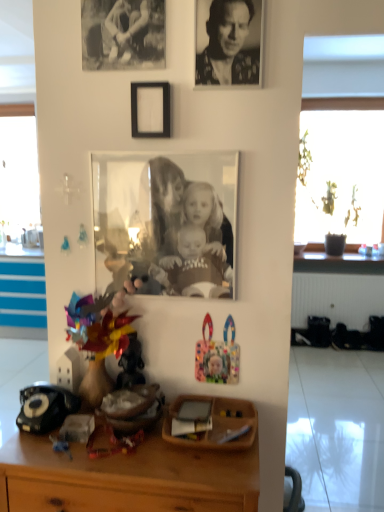
I want to click on matte glass photo frame at center, placed as the 1th picture frame when sorted from bottom to top, so click(165, 224).

This screenshot has height=512, width=384. In order to click on shiny metallic figurine at center, the 2th toy in the left-to-right sequence in this screenshot , I will do `click(131, 364)`.

Locate an element on the screen. The height and width of the screenshot is (512, 384). black matte picture frame at upper center, the 2th picture frame from the bottom is located at coordinates (150, 109).

The width and height of the screenshot is (384, 512). I want to click on matte glass photo frame at center, positioned as the third picture frame in top-to-bottom order, so click(x=165, y=224).

Could you tell me if black paper at upper left, the 3th picture frame when ordered from bottom to top, is facing black matte picture frame at upper center, the second picture frame when ordered from top to bottom?

No, black paper at upper left, the 3th picture frame when ordered from bottom to top, is not aimed at black matte picture frame at upper center, the second picture frame when ordered from top to bottom.

Is point (155, 2) closer or farther from the camera than point (150, 121)?

Point (155, 2) is closer to the camera than point (150, 121).

Does black paper at upper left, the 3th picture frame when ordered from bottom to top, come in front of black matte picture frame at upper center, the 2th picture frame from the bottom?

Yes, black paper at upper left, the 3th picture frame when ordered from bottom to top, is closer to the viewer.

Which object is thinner, black paper at upper left, which appears as the 1th picture frame when viewed from the top, or black matte picture frame at upper center, the 2th picture frame from the bottom?

Thinner between the two is black paper at upper left, which appears as the 1th picture frame when viewed from the top.

Which object is more forward, black paper at upper left, the 3th picture frame when ordered from bottom to top, or shiny metallic toy at center, which appears as the 3th toy when viewed from the right?

shiny metallic toy at center, which appears as the 3th toy when viewed from the right, is more forward.

Does point (140, 17) lie in front of point (95, 355)?

Yes, it is.

What's the angular difference between black paper at upper left, the 3th picture frame when ordered from bottom to top, and shiny metallic toy at center, which appears as the 3th toy when viewed from the right,'s facing directions?

1.69 degrees separate the facing orientations of black paper at upper left, the 3th picture frame when ordered from bottom to top, and shiny metallic toy at center, which appears as the 3th toy when viewed from the right.

Is black paper at upper left, which appears as the 1th picture frame when viewed from the top, oriented towards shiny metallic toy at center, which appears as the 3th toy when viewed from the right?

No, black paper at upper left, which appears as the 1th picture frame when viewed from the top, is not facing towards shiny metallic toy at center, which appears as the 3th toy when viewed from the right.

Which of these two, matte glass photo frame at center, positioned as the third picture frame in top-to-bottom order, or shiny metallic figurine at center, the 2th toy in the left-to-right sequence, stands shorter?

shiny metallic figurine at center, the 2th toy in the left-to-right sequence, is shorter.

Based on the photo, is shiny metallic figurine at center, the 2th toy in the left-to-right sequence, inside matte glass photo frame at center, positioned as the third picture frame in top-to-bottom order?

No, matte glass photo frame at center, positioned as the third picture frame in top-to-bottom order, does not contain shiny metallic figurine at center, the 2th toy in the left-to-right sequence.

Is shiny metallic figurine at center, the 2th toy in the left-to-right sequence, at the back of matte glass photo frame at center, positioned as the third picture frame in top-to-bottom order?

No.

From the image's perspective, would you say shiny metallic figurine at center, the 2th toy in the left-to-right sequence, is positioned over black textured photo at upper center?

No, from the image's perspective, shiny metallic figurine at center, the 2th toy in the left-to-right sequence, is not on top of black textured photo at upper center.

How many degrees apart are the facing directions of shiny metallic figurine at center, the 2th toy in the left-to-right sequence, and black textured photo at upper center?

The angle between the facing direction of shiny metallic figurine at center, the 2th toy in the left-to-right sequence, and the facing direction of black textured photo at upper center is 0.724 degrees.

Can you confirm if shiny metallic figurine at center, the 2th toy in the left-to-right sequence, is shorter than black textured photo at upper center?

Correct, shiny metallic figurine at center, the 2th toy in the left-to-right sequence, is not as tall as black textured photo at upper center.

From a real-world perspective, is shiny metallic figurine at center, marked as the second toy in a right-to-left arrangement, above or below black textured photo at upper center?

shiny metallic figurine at center, marked as the second toy in a right-to-left arrangement, is below black textured photo at upper center.

Is shiny metallic figurine at center, the 2th toy in the left-to-right sequence, with wooden desk at center?

No, shiny metallic figurine at center, the 2th toy in the left-to-right sequence, is not touching wooden desk at center.

Would you say wooden desk at center is part of shiny metallic figurine at center, marked as the second toy in a right-to-left arrangement,'s contents?

No, wooden desk at center is not inside shiny metallic figurine at center, marked as the second toy in a right-to-left arrangement.

Which point is more distant from viewer, (139, 353) or (44, 441)?

Point (139, 353)

From the image's perspective, which toy is the 1st one above the wooden desk at center? Please provide its 2D coordinates.

[(131, 364)]

Does black matte picture frame at upper center, the 2th picture frame from the bottom, lie in front of wooden desk at center?

No, black matte picture frame at upper center, the 2th picture frame from the bottom, is behind wooden desk at center.

From the picture: From a real-world perspective, is black matte picture frame at upper center, the second picture frame when ordered from top to bottom, positioned under wooden desk at center based on gravity?

No, from a real-world perspective, black matte picture frame at upper center, the second picture frame when ordered from top to bottom, is not below wooden desk at center.

Does point (159, 115) appear closer or farther from the camera than point (158, 436)?

Point (159, 115) is positioned farther from the camera compared to point (158, 436).

In terms of height, does black matte picture frame at upper center, the 2th picture frame from the bottom, look taller or shorter compared to wooden desk at center?

Considering their sizes, black matte picture frame at upper center, the 2th picture frame from the bottom, has less height than wooden desk at center.

Is shiny metallic figurine at center, marked as the second toy in a right-to-left arrangement, looking in the opposite direction of matte glass photo frame at center, placed as the 1th picture frame when sorted from bottom to top?

No, shiny metallic figurine at center, marked as the second toy in a right-to-left arrangement, is not facing away from matte glass photo frame at center, placed as the 1th picture frame when sorted from bottom to top.

Looking at this image, from the image's perspective, is shiny metallic figurine at center, the 2th toy in the left-to-right sequence, located above matte glass photo frame at center, positioned as the third picture frame in top-to-bottom order?

Incorrect, from the image's perspective, shiny metallic figurine at center, the 2th toy in the left-to-right sequence, is lower than matte glass photo frame at center, positioned as the third picture frame in top-to-bottom order.

Do you think shiny metallic figurine at center, the 2th toy in the left-to-right sequence, is within matte glass photo frame at center, placed as the 1th picture frame when sorted from bottom to top, or outside of it?

The correct answer is: outside.

Find the location of a particular element. The image size is (384, 512). picture frame on the left of black matte picture frame at upper center, the second picture frame when ordered from top to bottom is located at coordinates (123, 34).

From the image's perspective, count 1st toys downward from the black paper at upper left, the 3th picture frame when ordered from bottom to top, and point to it. Please provide its 2D coordinates.

[(101, 352)]

Estimate the real-world distances between objects in this image. Which object is further from multicolored plastic toy at lower center, which is the first toy in right-to-left order, shiny metallic toy at center, acting as the first toy starting from the left, or black textured photo at upper center?

The object further to multicolored plastic toy at lower center, which is the first toy in right-to-left order, is black textured photo at upper center.

Which object lies further to the anchor point black paper at upper left, the 3th picture frame when ordered from bottom to top, black textured photo at upper center or matte glass photo frame at center, positioned as the third picture frame in top-to-bottom order?

The object further to black paper at upper left, the 3th picture frame when ordered from bottom to top, is matte glass photo frame at center, positioned as the third picture frame in top-to-bottom order.

Looking at the image, which one is located closer to wooden desk at center, black paper at upper left, the 3th picture frame when ordered from bottom to top, or matte glass photo frame at center, positioned as the third picture frame in top-to-bottom order?

matte glass photo frame at center, positioned as the third picture frame in top-to-bottom order, lies closer to wooden desk at center than the other object.

From the image, which object appears to be farther from wooden desk at center, black matte picture frame at upper center, the 2th picture frame from the bottom, or shiny metallic toy at center, which appears as the 3th toy when viewed from the right?

black matte picture frame at upper center, the 2th picture frame from the bottom, is positioned further to the anchor wooden desk at center.

From the picture: Based on their spatial positions, is shiny metallic figurine at center, the 2th toy in the left-to-right sequence, or black paper at upper left, which appears as the 1th picture frame when viewed from the top, further from matte glass photo frame at center, placed as the 1th picture frame when sorted from bottom to top?

Based on the image, black paper at upper left, which appears as the 1th picture frame when viewed from the top, appears to be further to matte glass photo frame at center, placed as the 1th picture frame when sorted from bottom to top.

Estimate the real-world distances between objects in this image. Which object is further from black textured photo at upper center, shiny metallic toy at center, which appears as the 3th toy when viewed from the right, or multicolored plastic toy at lower center, which is the first toy in right-to-left order?

Among the two, shiny metallic toy at center, which appears as the 3th toy when viewed from the right, is located further to black textured photo at upper center.

Which object lies further to the anchor point black matte picture frame at upper center, the second picture frame when ordered from top to bottom, black paper at upper left, the 3th picture frame when ordered from bottom to top, or shiny metallic toy at center, which appears as the 3th toy when viewed from the right?

The object further to black matte picture frame at upper center, the second picture frame when ordered from top to bottom, is shiny metallic toy at center, which appears as the 3th toy when viewed from the right.

Based on their spatial positions, is wooden desk at center or black textured photo at upper center further from black matte picture frame at upper center, the second picture frame when ordered from top to bottom?

wooden desk at center.

Identify the location of person between black paper at upper left, which appears as the 1th picture frame when viewed from the top, and shiny metallic toy at center, which appears as the 3th toy when viewed from the right, from top to bottom. (228, 46).

Identify the location of person between black paper at upper left, which appears as the 1th picture frame when viewed from the top, and shiny metallic figurine at center, marked as the second toy in a right-to-left arrangement, in the vertical direction. (228, 46).

You are a GUI agent. You are given a task and a screenshot of the screen. Output one action in this format:
    pyautogui.click(x=<x>, y=<y>)
    Task: Click on the picture frame between black matte picture frame at upper center, the second picture frame when ordered from top to bottom, and shiny metallic figurine at center, marked as the second toy in a right-to-left arrangement, in the vertical direction
    
    Given the screenshot: What is the action you would take?
    pyautogui.click(x=165, y=224)

Locate an element on the screen. toy between multicolored plastic toy at lower center, which appears as the 3th toy when viewed from the left, and wooden desk at center vertically is located at coordinates (131, 364).